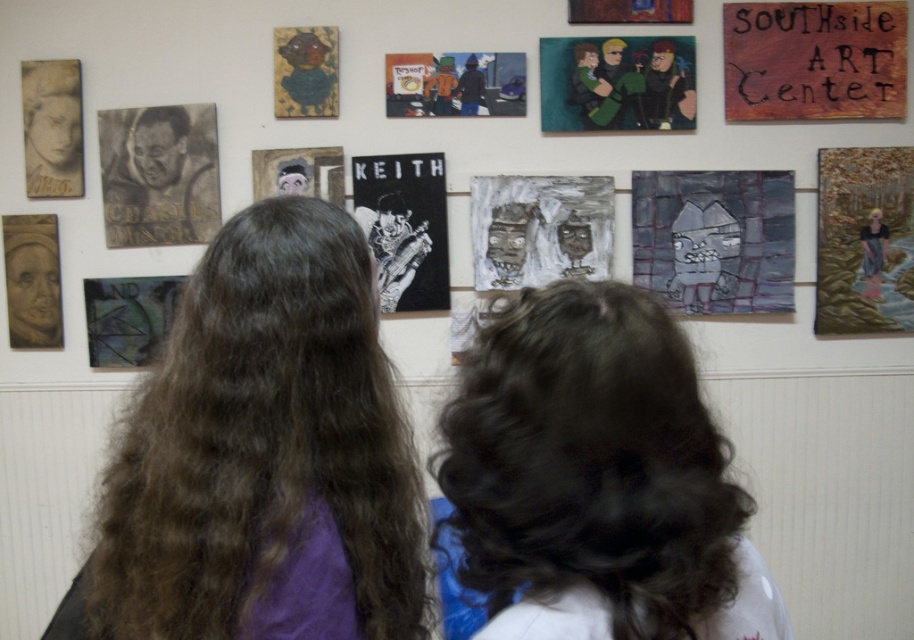
Question: Can you confirm if matte black abstract painting at center is bigger than charcoal drawing of a man at left?

Choices:
 (A) yes
 (B) no

Answer: (A)

Question: Which object is farther from the camera taking this photo?

Choices:
 (A) matte black portrait of charles mingus at left
 (B) black paper keith at center
 (C) matte black portrait at upper center

Answer: (A)

Question: Among these points, which one is nearest to the camera?

Choices:
 (A) (448, 67)
 (B) (532, 508)
 (C) (684, 6)
 (D) (149, 32)

Answer: (B)

Question: Can you confirm if matte black portrait at upper center is bigger than golden hair at upper right?

Choices:
 (A) yes
 (B) no

Answer: (A)

Question: Which point is farther to the camera?

Choices:
 (A) matte black keith poster at center
 (B) matte green painting at upper left

Answer: (A)

Question: Is wooden sign at upper right to the right of black paper keith at center from the viewer's perspective?

Choices:
 (A) no
 (B) yes

Answer: (B)